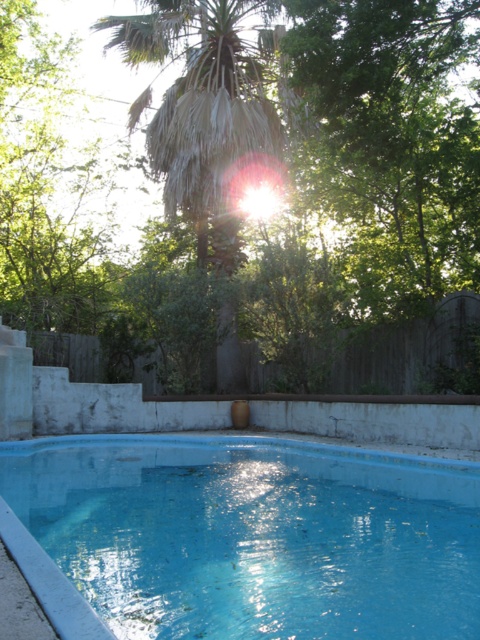
Does point (192, 45) come in front of point (338, 531)?

No, it is not.

Is green leafy tree at upper center in front of blue painted concrete swimming pool at center?

No, green leafy tree at upper center is further to the viewer.

Between point (310, 118) and point (183, 493), which one is positioned in front?

Point (183, 493) is in front.

Locate an element on the screen. This screenshot has width=480, height=640. green leafy tree at upper center is located at coordinates (286, 211).